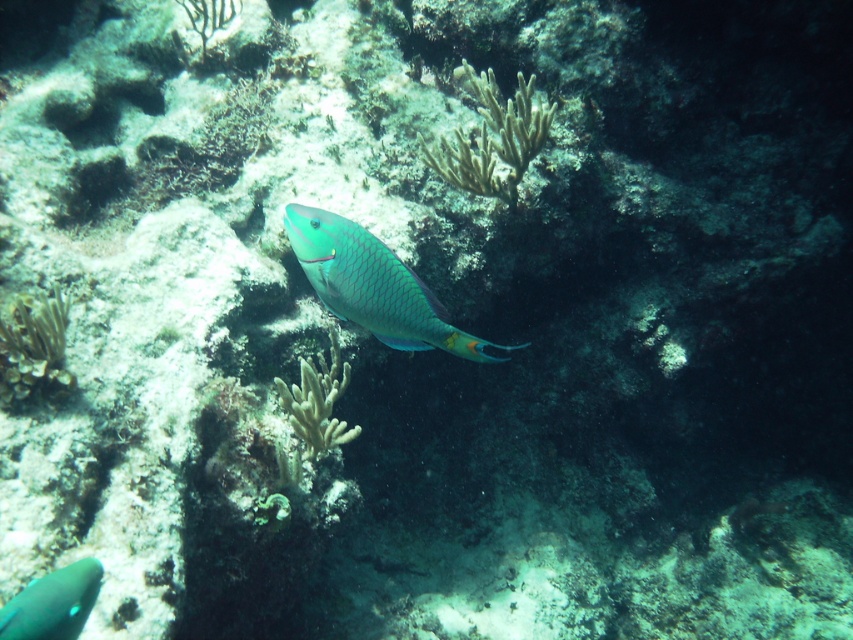
Does yellowish-green textured coral at center appear under green soft coral at lower left?

No, yellowish-green textured coral at center is not below green soft coral at lower left.

Can you confirm if yellowish-green textured coral at center is bigger than green soft coral at lower left?

Yes.

Image resolution: width=853 pixels, height=640 pixels. Describe the element at coordinates (492, 140) in the screenshot. I see `yellowish-green textured coral at center` at that location.

Image resolution: width=853 pixels, height=640 pixels. What are the coordinates of `yellowish-green textured coral at center` in the screenshot? It's located at (492, 140).

Is teal glossy fish at center closer to camera compared to green soft coral at lower left?

Yes.

Who is lower down, teal glossy fish at center or green soft coral at lower left?

green soft coral at lower left is lower down.

Who is more forward, (409, 333) or (18, 349)?

Point (409, 333) is more forward.

You are a GUI agent. You are given a task and a screenshot of the screen. Output one action in this format:
    pyautogui.click(x=<x>, y=<y>)
    Task: Click on the teal glossy fish at center
    
    Given the screenshot: What is the action you would take?
    pyautogui.click(x=374, y=285)

Between teal glossy fish at center and teal glossy fish at lower left, which one has less height?

Standing shorter between the two is teal glossy fish at lower left.

How distant is teal glossy fish at center from teal glossy fish at lower left?

The distance of teal glossy fish at center from teal glossy fish at lower left is 20.61 inches.

Who is more distant from viewer, (360, 268) or (93, 564)?

Point (360, 268)

Where is `teal glossy fish at center`? This screenshot has height=640, width=853. teal glossy fish at center is located at coordinates (374, 285).